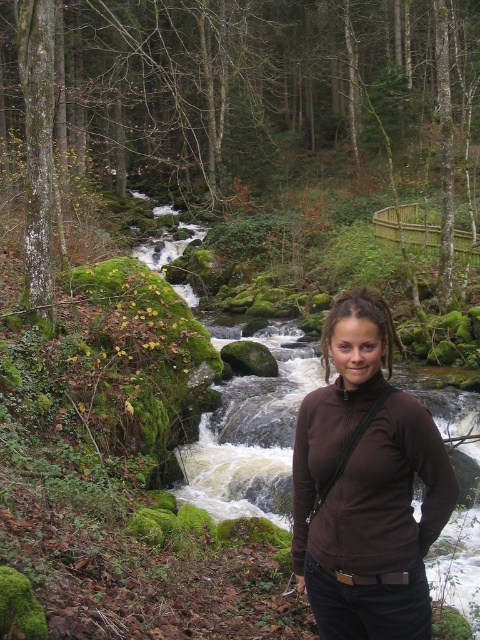
You are a photographer trying to capture the entire scene in one shot. Given that the brown matte jacket at center and the white frothy water at center are both important elements, which object should you ensure is more prominently featured in your composition?

The white frothy water at center should be more prominently featured in the composition since it occupies more space than the brown matte jacket at center according to the description.

You are a photographer trying to capture the entire scene in one shot. Given that your camera can only focus on objects wider than 2 meters, will both the brown matte jacket at center and the white frothy water at center be in focus?

The brown matte jacket at center is narrower than the white frothy water at center. Since the camera requires objects to be wider than 2 meters to focus, only the white frothy water at center will be in focus if it meets the width requirement, but the jacket may not. However, the exact focus depends on their actual widths, which aren

You are a photographer standing at the camera position. You want to take a closeup shot of the brown matte jacket at center. Can you reach it without moving from your current position if your longest available lens has a 200mm focal length?

The brown matte jacket at center is 6.60 feet away from the camera. With a 200mm lens, you can capture a closeup shot from that distance without needing to move closer.